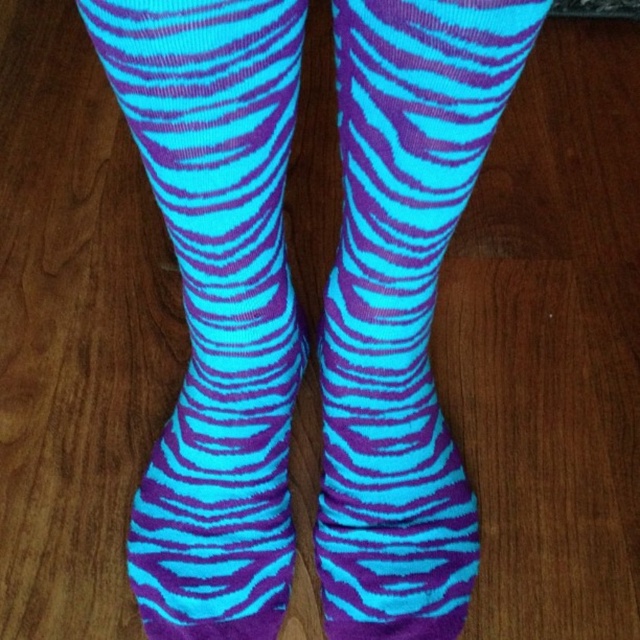
Question: Is neon blue zebra-patterned sock at center smaller than turquoise matte socks at center?

Choices:
 (A) no
 (B) yes

Answer: (A)

Question: Among these objects, which one is farthest from the camera?

Choices:
 (A) neon blue zebra-patterned sock at center
 (B) turquoise matte socks at center

Answer: (B)

Question: Which object appears farthest from the camera in this image?

Choices:
 (A) turquoise matte socks at center
 (B) neon blue zebra-patterned sock at center

Answer: (A)

Question: Can you confirm if neon blue zebra-patterned sock at center is positioned below turquoise matte socks at center?

Choices:
 (A) no
 (B) yes

Answer: (A)

Question: Does neon blue zebra-patterned sock at center have a larger size compared to turquoise matte socks at center?

Choices:
 (A) no
 (B) yes

Answer: (B)